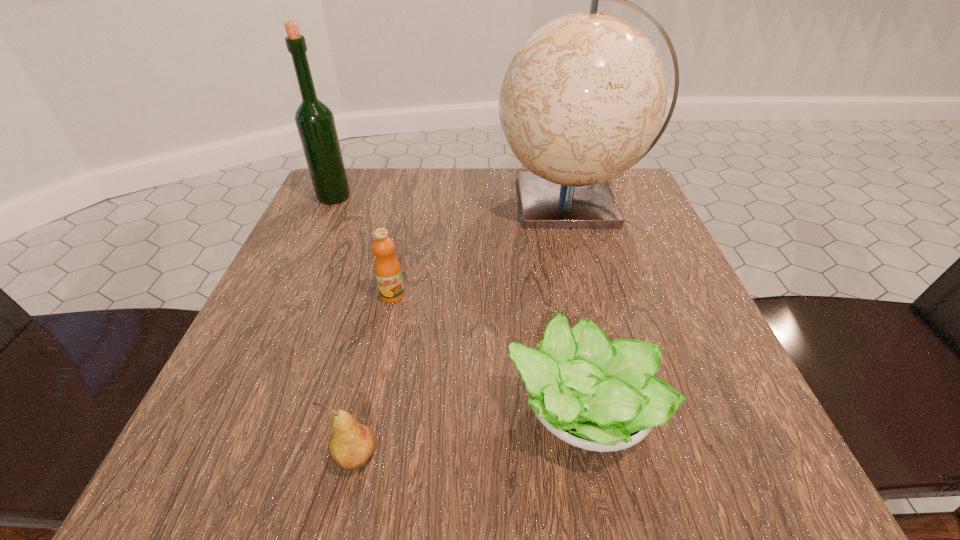
You are a GUI agent. You are given a task and a screenshot of the screen. Output one action in this format:
    pyautogui.click(x=<x>, y=<y>)
    Task: Click on the vacant region that satisfies the following two spatial constraints: 1. on the back side of the pear; 2. on the right side of the lettuce
    
    Given the screenshot: What is the action you would take?
    pyautogui.click(x=366, y=410)